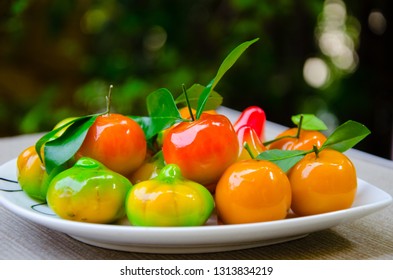
I want to click on dish, so click(x=225, y=232).